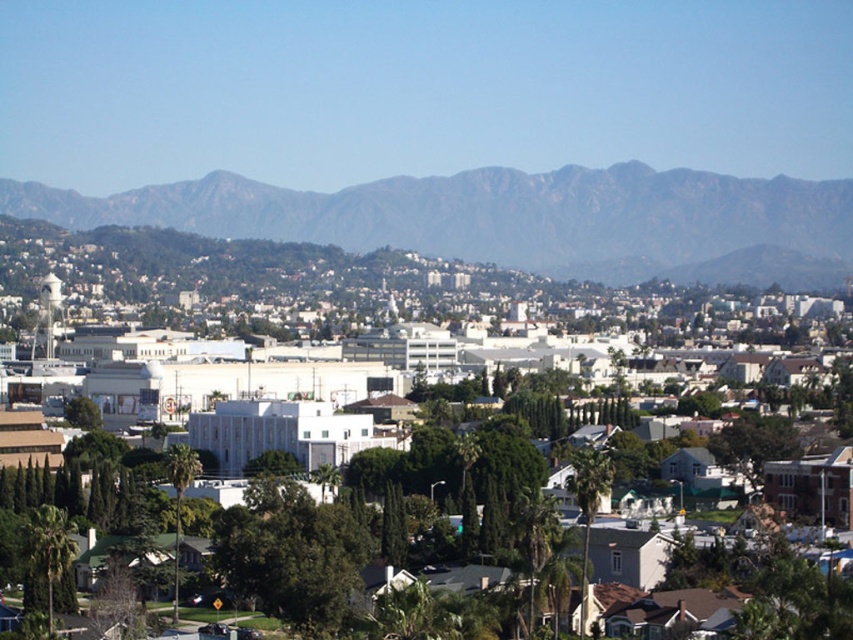
Which is more to the left, green leafy palm tree at center or green leafy palm tree at lower left?

green leafy palm tree at lower left is more to the left.

Can you confirm if green leafy palm tree at center is smaller than green leafy palm tree at lower left?

No.

You are a GUI agent. You are given a task and a screenshot of the screen. Output one action in this format:
    pyautogui.click(x=<x>, y=<y>)
    Task: Click on the green leafy palm tree at center
    
    Given the screenshot: What is the action you would take?
    pyautogui.click(x=589, y=506)

At what (x,y) coordinates should I click in order to perform the action: click on green leafy palm tree at center. Please return your answer as a coordinate pair (x, y). Image resolution: width=853 pixels, height=640 pixels. Looking at the image, I should click on (589, 506).

Is green leafy tree at center below green leafy palm tree at lower left?

Incorrect, green leafy tree at center is not positioned below green leafy palm tree at lower left.

Is green leafy tree at center bigger than green leafy palm tree at lower left?

Incorrect, green leafy tree at center is not larger than green leafy palm tree at lower left.

Is point (253, 550) behind point (73, 529)?

No, it is in front of (73, 529).

Identify the location of green leafy tree at center. This screenshot has width=853, height=640. (291, 554).

Does point (601, 262) come farther from viewer compared to point (335, 625)?

Yes, point (601, 262) is farther from viewer.

Which is behind, point (585, 218) or point (318, 561)?

The point (585, 218) is behind.

Is point (57, 211) positioned after point (276, 532)?

Yes, it is behind point (276, 532).

I want to click on gray rocky mountain at upper center, so click(x=514, y=220).